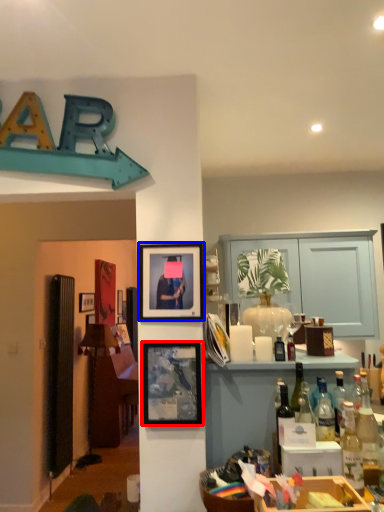
Question: Among these objects, which one is farthest to the camera, picture frame (highlighted by a red box) or picture frame (highlighted by a blue box)?

Choices:
 (A) picture frame
 (B) picture frame

Answer: (B)